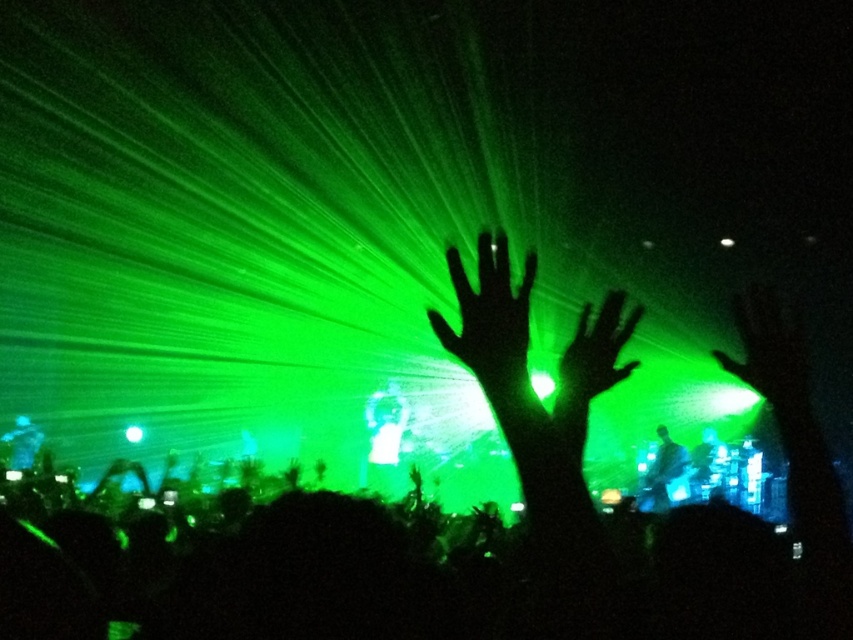
Is silhouette hands at center taller than shiny black guitar at center?

Yes, silhouette hands at center is taller than shiny black guitar at center.

Is point (288, 538) behind point (659, 486)?

No, (288, 538) is closer to viewer.

Who is more forward, (387, 564) or (668, 502)?

Point (387, 564) is more forward.

The width and height of the screenshot is (853, 640). I want to click on silhouette hands at center, so click(x=518, y=538).

Can you confirm if green matte hand at center is positioned to the left of shiny black guitar at center?

Correct, you'll find green matte hand at center to the left of shiny black guitar at center.

Who is shorter, green matte hand at center or shiny black guitar at center?

green matte hand at center

Who is more forward, (570, 349) or (666, 497)?

Positioned in front is point (570, 349).

Identify the location of green matte hand at center. (595, 355).

Which is below, silhouette hands at center or green translucent hand at upper right?

silhouette hands at center

In the scene shown: Does silhouette hands at center appear on the left side of green translucent hand at upper right?

Yes, silhouette hands at center is to the left of green translucent hand at upper right.

Is point (375, 502) positioned after point (790, 317)?

No, (375, 502) is closer to viewer.

The image size is (853, 640). Identify the location of silhouette hands at center. (518, 538).